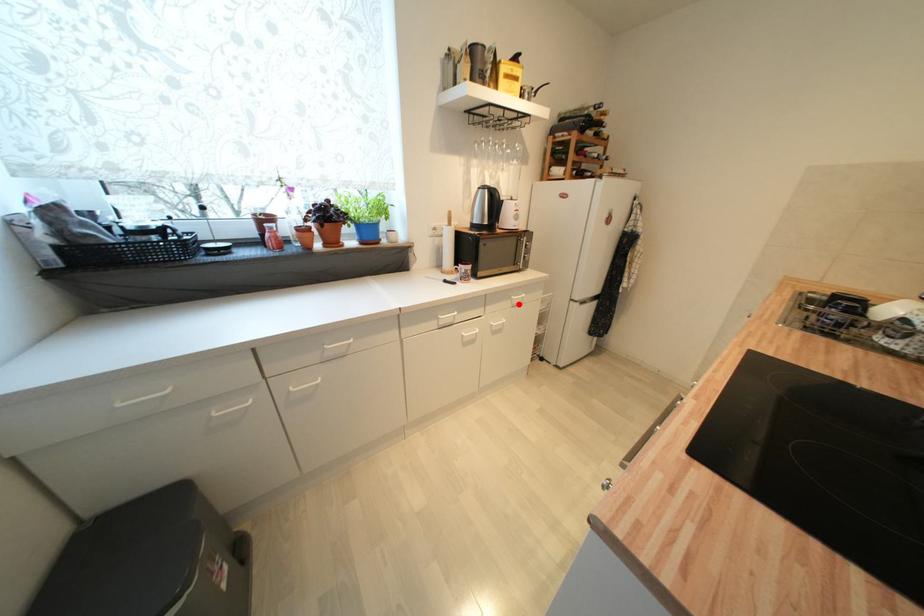
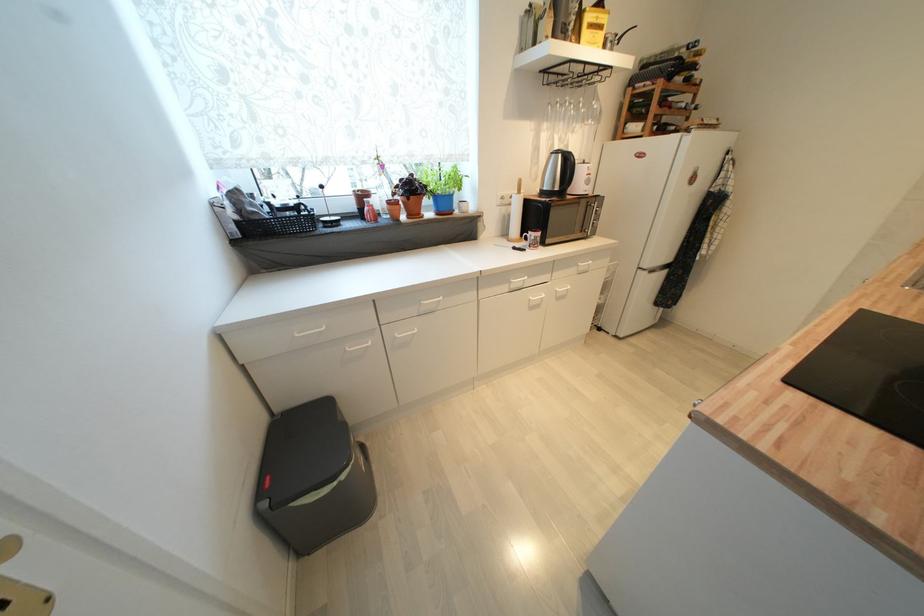
Question: I am providing you with two images of the same scene from different viewpoints. A red point is marked on the first image. Is the red point's position out of view in image 2?

Choices:
 (A) Yes
 (B) No

Answer: (B)